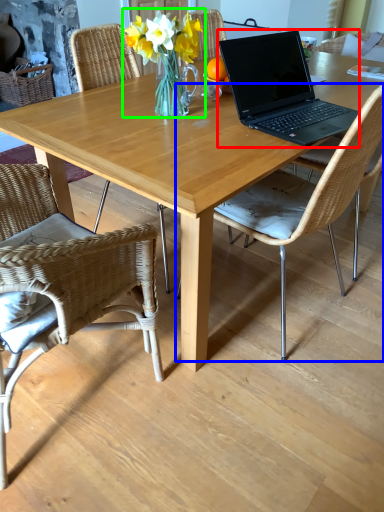
Question: Considering the real-world distances, which object is closest to laptop (highlighted by a red box)? chair (highlighted by a blue box) or floral arrangement (highlighted by a green box).

Choices:
 (A) chair
 (B) floral arrangement

Answer: (A)